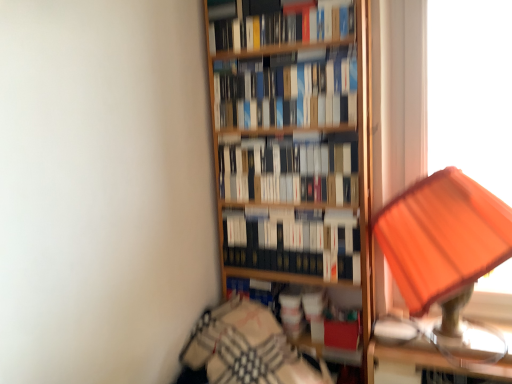
Question: Can you confirm if orange fabric lampshade at right is thinner than metallic gold table at right?

Choices:
 (A) yes
 (B) no

Answer: (B)

Question: Considering the relative sizes of orange fabric lampshade at right and metallic gold table at right in the image provided, is orange fabric lampshade at right shorter than metallic gold table at right?

Choices:
 (A) yes
 (B) no

Answer: (B)

Question: Would you say metallic gold table at right is part of orange fabric lampshade at right's contents?

Choices:
 (A) no
 (B) yes

Answer: (A)

Question: From the image's perspective, would you say orange fabric lampshade at right is shown under metallic gold table at right?

Choices:
 (A) no
 (B) yes

Answer: (A)

Question: Is orange fabric lampshade at right closer to the viewer compared to metallic gold table at right?

Choices:
 (A) no
 (B) yes

Answer: (B)

Question: From a real-world perspective, is orange fabric lampshade at right below metallic gold table at right?

Choices:
 (A) yes
 (B) no

Answer: (B)

Question: From the image's perspective, is metallic gold table at right on top of hardcover books at center, marked as the fourth book in a top-to-bottom arrangement?

Choices:
 (A) no
 (B) yes

Answer: (A)

Question: Could you tell me if metallic gold table at right is facing hardcover books at center, which ranks as the first book in bottom-to-top order?

Choices:
 (A) yes
 (B) no

Answer: (B)

Question: Can you confirm if metallic gold table at right is thinner than hardcover books at center, marked as the fourth book in a top-to-bottom arrangement?

Choices:
 (A) no
 (B) yes

Answer: (A)

Question: Considering the relative sizes of metallic gold table at right and hardcover books at center, which ranks as the first book in bottom-to-top order, in the image provided, is metallic gold table at right shorter than hardcover books at center, which ranks as the first book in bottom-to-top order,?

Choices:
 (A) yes
 (B) no

Answer: (A)

Question: From a real-world perspective, is metallic gold table at right beneath hardcover books at center, marked as the fourth book in a top-to-bottom arrangement?

Choices:
 (A) no
 (B) yes

Answer: (B)

Question: Would you say metallic gold table at right is a long distance from hardcover books at center, which ranks as the first book in bottom-to-top order?

Choices:
 (A) yes
 (B) no

Answer: (B)

Question: Considering the relative sizes of hardcover books at upper center, the fourth book in the bottom-to-top sequence, and hardcover books at center, which is the second book in top-to-bottom order, in the image provided, is hardcover books at upper center, the fourth book in the bottom-to-top sequence, taller than hardcover books at center, which is the second book in top-to-bottom order,?

Choices:
 (A) yes
 (B) no

Answer: (B)